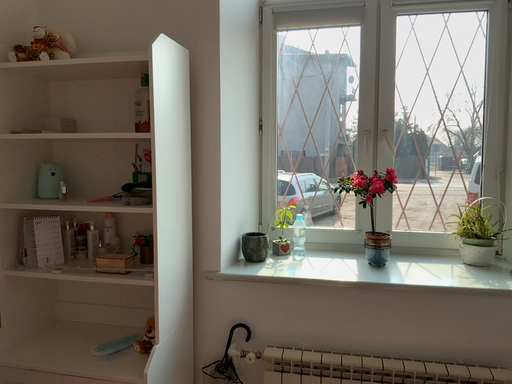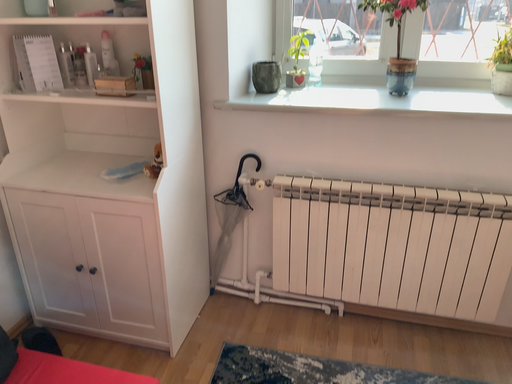
Question: Which way did the camera rotate in the video?

Choices:
 (A) rotated upward
 (B) rotated downward

Answer: (B)